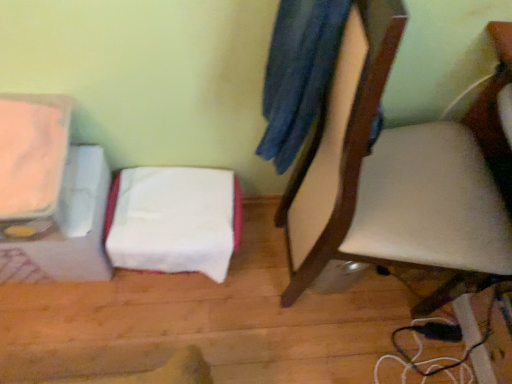
Image resolution: width=512 pixels, height=384 pixels. In order to click on free space in front of white fabric at lower left in this screenshot , I will do `click(159, 335)`.